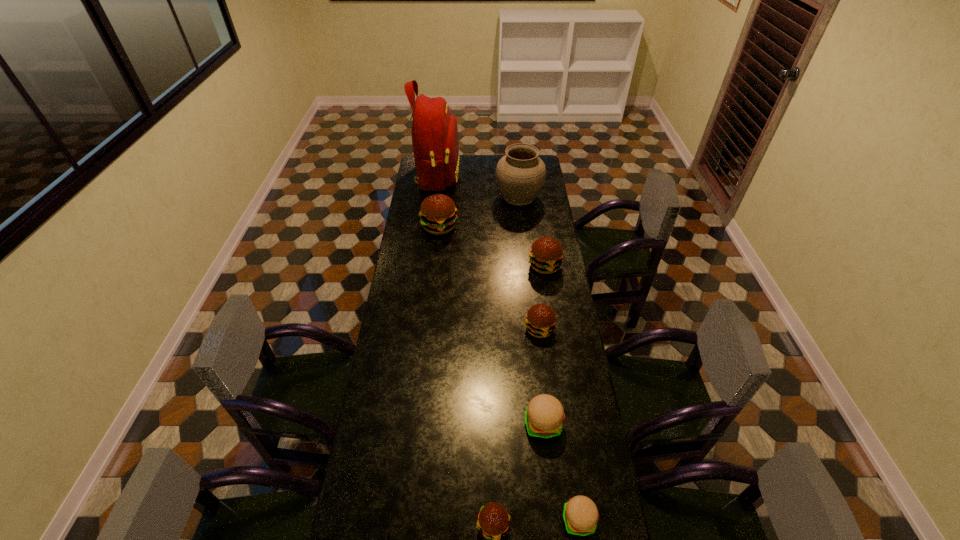
Find the location of a particular element. The image size is (960, 540). backpack that is at the left edge is located at coordinates (435, 141).

Where is `hamburger that is at the left edge`? The image size is (960, 540). hamburger that is at the left edge is located at coordinates (438, 215).

At what (x,y) coordinates should I click in order to perform the action: click on urn located in the right edge section of the desktop. Please return your answer as a coordinate pair (x, y). The image size is (960, 540). Looking at the image, I should click on (520, 174).

Where is `object that is at the far left corner`? object that is at the far left corner is located at coordinates (435, 141).

The image size is (960, 540). Identify the location of free space at the far edge of the desktop. [x=482, y=159].

This screenshot has height=540, width=960. I want to click on blank space at the left edge, so point(405,271).

Identify the location of vacant area at the right edge of the desktop. (561, 393).

Identify the location of empty location between the fourth farthest hamburger and the fifth shortest hamburger. The height and width of the screenshot is (540, 960). (544, 345).

At what (x,y) coordinates should I click in order to perform the action: click on free space between the third nearest brown hamburger and the nearer beige hamburger. Please return your answer as a coordinate pair (x, y). The height and width of the screenshot is (540, 960). Looking at the image, I should click on (562, 393).

This screenshot has height=540, width=960. I want to click on vacant space that is in between the fifth shortest hamburger and the nearer beige hamburger, so click(x=562, y=393).